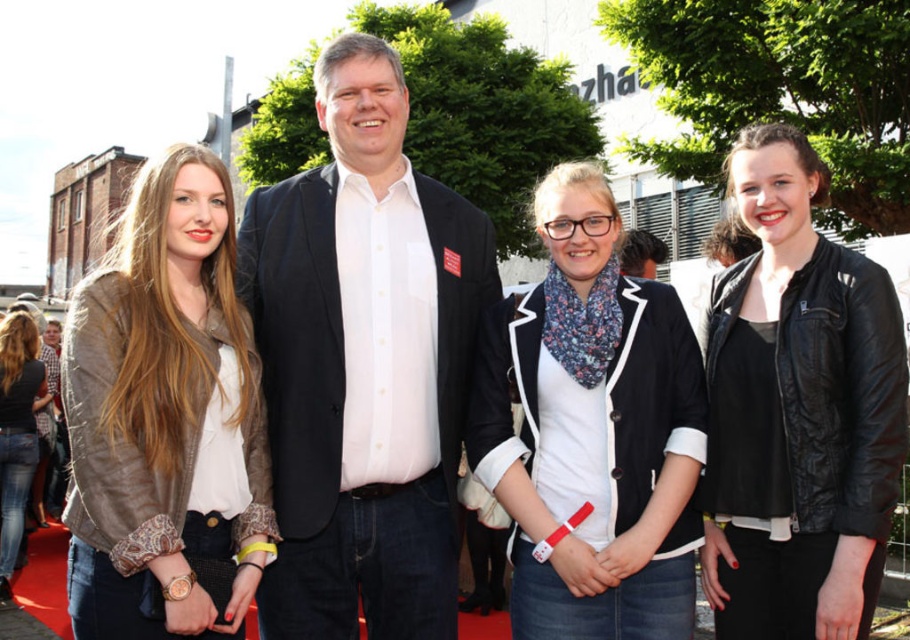
You are standing at the event venue and want to take a photo of the point located at coordinates point (784,305). Given that your camera has a maximum focus range of 70 feet, will you be able to capture the point clearly?

The point (784,305) is 72.36 feet away from the viewer, which exceeds the camera maximum focus range of 70 feet. Therefore, the point cannot be captured clearly.